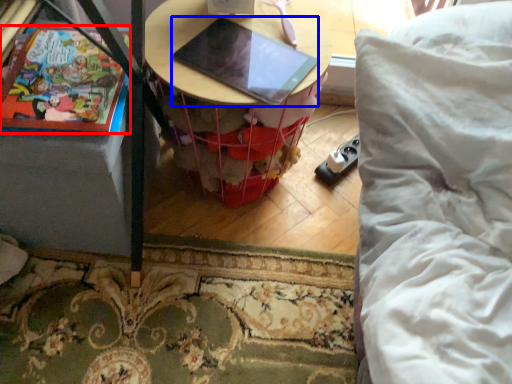
Question: Which of the following is the farthest to the observer, comic book (highlighted by a red box) or laptop (highlighted by a blue box)?

Choices:
 (A) comic book
 (B) laptop

Answer: (B)